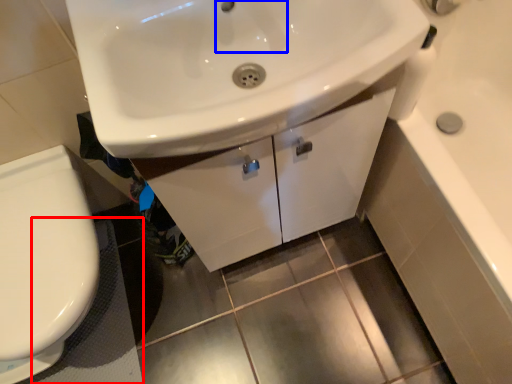
Question: Which point is closer to the camera, bath mat (highlighted by a red box) or faucet (highlighted by a blue box)?

Choices:
 (A) bath mat
 (B) faucet

Answer: (B)